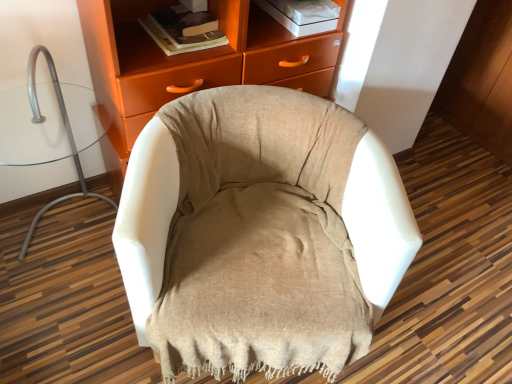
Locate an element on the screen. This screenshot has width=512, height=384. free spot above hardcover book at upper center (from a real-world perspective) is located at coordinates (179, 22).